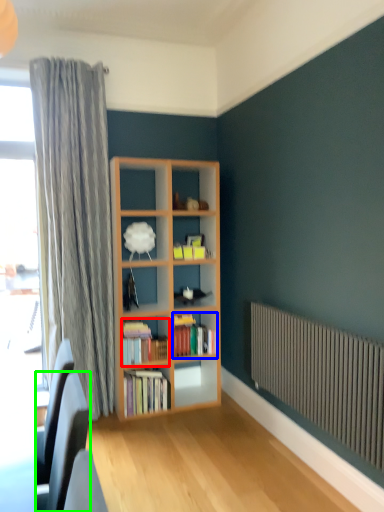
Question: Estimate the real-world distances between objects in this image. Which object is closer to book (highlighted by a red box), book (highlighted by a blue box) or swivel chair (highlighted by a green box)?

Choices:
 (A) book
 (B) swivel chair

Answer: (A)